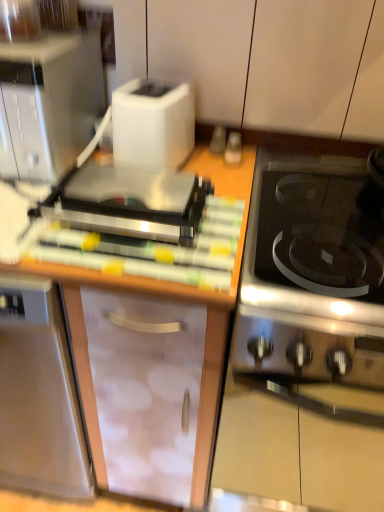
Image resolution: width=384 pixels, height=512 pixels. I want to click on blank space above wooden cutting board at center (from a real-world perspective), so click(147, 246).